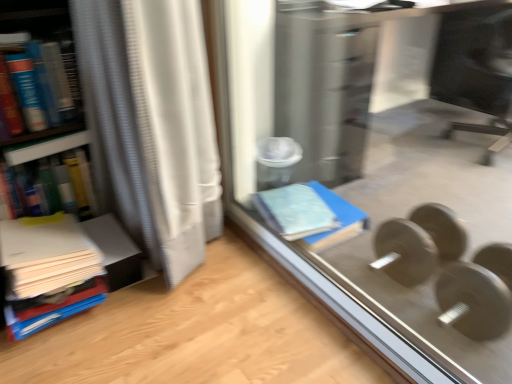
The height and width of the screenshot is (384, 512). Describe the element at coordinates (388, 168) in the screenshot. I see `transparent glass door at center` at that location.

The image size is (512, 384). What do you see at coordinates (449, 269) in the screenshot?
I see `matte gray dumbbell at lower right, arranged as the 2th dumbbell when viewed from the back` at bounding box center [449, 269].

Locate an element on the screen. The image size is (512, 384). transparent glass door at center is located at coordinates (388, 168).

Consider the image. Is hardcover book at left, the first book in the top-to-bottom sequence, next to white textured curtain at left?

No, hardcover book at left, the first book in the top-to-bottom sequence, is not making contact with white textured curtain at left.

How far apart are hardcover book at left, the first book in the top-to-bottom sequence, and white textured curtain at left?

hardcover book at left, the first book in the top-to-bottom sequence, is 12.79 inches from white textured curtain at left.

Which object is thinner, hardcover book at left, placed as the third book when sorted from bottom to top, or white textured curtain at left?

hardcover book at left, placed as the third book when sorted from bottom to top, is thinner.

From the picture: Is hardcover book at left, placed as the third book when sorted from bottom to top, inside or outside of white textured curtain at left?

The correct answer is: outside.

From a real-world perspective, who is located lower, matte plastic book at left, the 2th book ordered from the bottom, or black glossy monitor at upper right?

matte plastic book at left, the 2th book ordered from the bottom, is physically lower.

Which is more to the right, matte plastic book at left, the 2th book ordered from the bottom, or black glossy monitor at upper right?

black glossy monitor at upper right.

From the image's perspective, is matte plastic book at left, the 2th book ordered from the bottom, above black glossy monitor at upper right?

Incorrect, from the image's perspective, matte plastic book at left, the 2th book ordered from the bottom, is lower than black glossy monitor at upper right.

How many degrees apart are the facing directions of matte plastic book at left, the second book from the top, and black glossy monitor at upper right?

The angle between the facing direction of matte plastic book at left, the second book from the top, and the facing direction of black glossy monitor at upper right is 112 degrees.

Measure the distance between black glossy monitor at upper right and white matte paper stack at left, the 1th book from the bottom.

A distance of 2.56 meters exists between black glossy monitor at upper right and white matte paper stack at left, the 1th book from the bottom.

From a real-world perspective, who is located higher, black glossy monitor at upper right or white matte paper stack at left, the 1th book from the bottom?

black glossy monitor at upper right, from a real-world perspective.

Does point (464, 107) appear closer or farther from the camera than point (76, 274)?

Point (464, 107).

Does black glossy monitor at upper right turn towards white matte paper stack at left, positioned as the third book in top-to-bottom order?

Yes, black glossy monitor at upper right faces towards white matte paper stack at left, positioned as the third book in top-to-bottom order.

Which of these two, metallic gray dumbbell at lower right, which is counted as the second dumbbell, starting from the front, or matte plastic book at left, the second book from the top, stands taller?

Standing taller between the two is matte plastic book at left, the second book from the top.

Is point (433, 241) behind point (38, 171)?

Yes, it is behind point (38, 171).

Is metallic gray dumbbell at lower right, which is counted as the second dumbbell, starting from the front, touching matte plastic book at left, the 2th book ordered from the bottom?

metallic gray dumbbell at lower right, which is counted as the second dumbbell, starting from the front, and matte plastic book at left, the 2th book ordered from the bottom, are clearly separated.

From the picture: From the image's perspective, is metallic gray dumbbell at lower right, the first dumbbell in the back-to-front sequence, located above or below matte plastic book at left, the second book from the top?

metallic gray dumbbell at lower right, the first dumbbell in the back-to-front sequence, is below matte plastic book at left, the second book from the top.

Is hardcover book at left, placed as the third book when sorted from bottom to top, situated inside matte gray dumbbell at lower right, arranged as the 2th dumbbell when viewed from the back, or outside?

hardcover book at left, placed as the third book when sorted from bottom to top, lies outside matte gray dumbbell at lower right, arranged as the 2th dumbbell when viewed from the back.

Is hardcover book at left, placed as the third book when sorted from bottom to top, facing away from matte gray dumbbell at lower right, the 1th dumbbell from the front?

No, matte gray dumbbell at lower right, the 1th dumbbell from the front, is not at the back of hardcover book at left, placed as the third book when sorted from bottom to top.

Are white textured curtain at left and black glossy monitor at upper right far apart?

white textured curtain at left is far away from black glossy monitor at upper right.

Is white textured curtain at left turned away from black glossy monitor at upper right?

Yes, white textured curtain at left is facing away from black glossy monitor at upper right.

Is white textured curtain at left at the right side of black glossy monitor at upper right?

In fact, white textured curtain at left is to the left of black glossy monitor at upper right.

Between white textured curtain at left and black glossy monitor at upper right, which one has more height?

white textured curtain at left is taller.

Between white matte paper stack at left, positioned as the third book in top-to-bottom order, and hardcover book at left, the first book in the top-to-bottom sequence, which one has smaller size?

white matte paper stack at left, positioned as the third book in top-to-bottom order, is smaller.

Which is closer to the camera, (8, 294) or (47, 52)?

Point (8, 294) is positioned closer to the camera compared to point (47, 52).

From the image's perspective, is white matte paper stack at left, positioned as the third book in top-to-bottom order, above hardcover book at left, placed as the third book when sorted from bottom to top?

No.

Does white matte paper stack at left, positioned as the third book in top-to-bottom order, contain hardcover book at left, placed as the third book when sorted from bottom to top?

Actually, hardcover book at left, placed as the third book when sorted from bottom to top, is outside white matte paper stack at left, positioned as the third book in top-to-bottom order.

In order to click on curtain on the right of hardcover book at left, the first book in the top-to-bottom sequence in this screenshot , I will do `click(154, 122)`.

Where is `computer chair above the matte plastic book at left, the second book from the top (from the image's perspective)`? The width and height of the screenshot is (512, 384). computer chair above the matte plastic book at left, the second book from the top (from the image's perspective) is located at coordinates (476, 70).

When comparing their distances from matte gray dumbbell at lower right, the 1th dumbbell from the front, does transparent glass door at center or black glossy monitor at upper right seem closer?

transparent glass door at center lies closer to matte gray dumbbell at lower right, the 1th dumbbell from the front, than the other object.

When comparing their distances from metallic gray dumbbell at lower right, which is counted as the second dumbbell, starting from the front, does black glossy monitor at upper right or matte plastic book at left, the 2th book ordered from the bottom, seem further?

black glossy monitor at upper right is positioned further to the anchor metallic gray dumbbell at lower right, which is counted as the second dumbbell, starting from the front.

Looking at the image, which one is located further to black glossy monitor at upper right, transparent glass door at center or hardcover book at left, placed as the third book when sorted from bottom to top?

hardcover book at left, placed as the third book when sorted from bottom to top, is further to black glossy monitor at upper right.

Estimate the real-world distances between objects in this image. Which object is closer to transparent glass door at center, hardcover book at left, placed as the third book when sorted from bottom to top, or matte gray dumbbell at lower right, the 1th dumbbell from the front?

matte gray dumbbell at lower right, the 1th dumbbell from the front, is closer to transparent glass door at center.

Based on the photo, estimate the real-world distances between objects in this image. Which object is further from transparent glass door at center, matte plastic book at left, the 2th book ordered from the bottom, or metallic gray dumbbell at lower right, which is counted as the second dumbbell, starting from the front?

matte plastic book at left, the 2th book ordered from the bottom, is positioned further to the anchor transparent glass door at center.

When comparing their distances from hardcover book at left, placed as the third book when sorted from bottom to top, does transparent glass door at center or white textured curtain at left seem closer?

Among the two, white textured curtain at left is located nearer to hardcover book at left, placed as the third book when sorted from bottom to top.

From the image, which object appears to be nearer to metallic gray dumbbell at lower right, which is counted as the second dumbbell, starting from the front, matte gray dumbbell at lower right, the 1th dumbbell from the front, or matte plastic book at left, the second book from the top?

matte gray dumbbell at lower right, the 1th dumbbell from the front, lies closer to metallic gray dumbbell at lower right, which is counted as the second dumbbell, starting from the front, than the other object.

Which object lies nearer to the anchor point white matte paper stack at left, positioned as the third book in top-to-bottom order, matte plastic book at left, the second book from the top, or matte gray dumbbell at lower right, arranged as the 2th dumbbell when viewed from the back?

The object closer to white matte paper stack at left, positioned as the third book in top-to-bottom order, is matte plastic book at left, the second book from the top.

This screenshot has height=384, width=512. Find the location of `curtain situated between matte plastic book at left, the second book from the top, and transparent glass door at center from left to right`. curtain situated between matte plastic book at left, the second book from the top, and transparent glass door at center from left to right is located at coordinates (154, 122).

The height and width of the screenshot is (384, 512). I want to click on curtain located between hardcover book at left, placed as the third book when sorted from bottom to top, and metallic gray dumbbell at lower right, the first dumbbell in the back-to-front sequence, in the left-right direction, so click(x=154, y=122).

Where is `curtain between hardcover book at left, placed as the third book when sorted from bottom to top, and matte gray dumbbell at lower right, arranged as the 2th dumbbell when viewed from the back, in the horizontal direction`? curtain between hardcover book at left, placed as the third book when sorted from bottom to top, and matte gray dumbbell at lower right, arranged as the 2th dumbbell when viewed from the back, in the horizontal direction is located at coordinates (154, 122).

In order to click on dumbbell situated between white matte paper stack at left, positioned as the third book in top-to-bottom order, and matte gray dumbbell at lower right, the 1th dumbbell from the front, from left to right in this screenshot , I will do `click(419, 243)`.